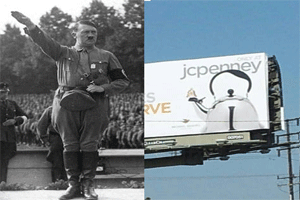
Where is `wall`? wall is located at coordinates (35, 161).